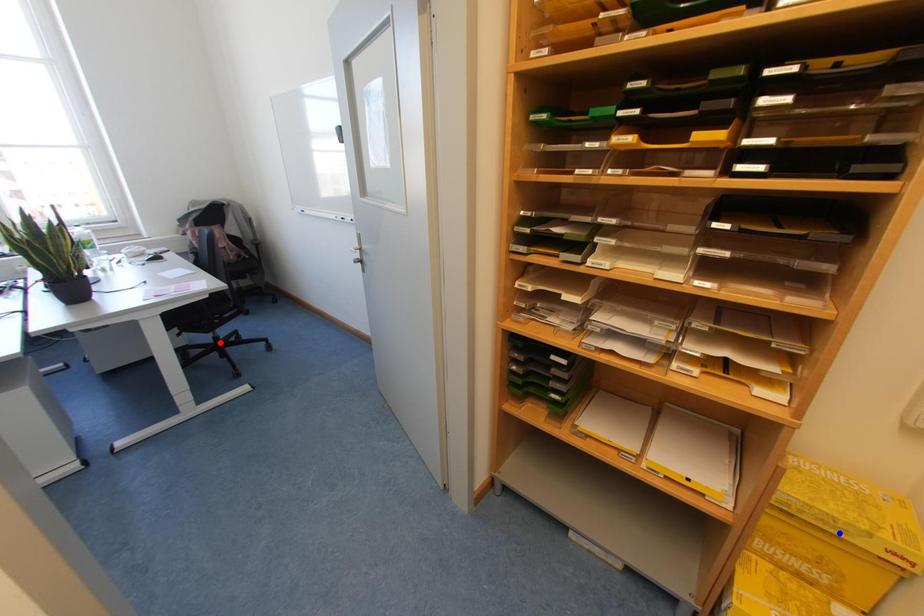
Question: Two points are marked on the image. Which point is closer to the camera?

Choices:
 (A) Blue point is closer.
 (B) Red point is closer.

Answer: (A)